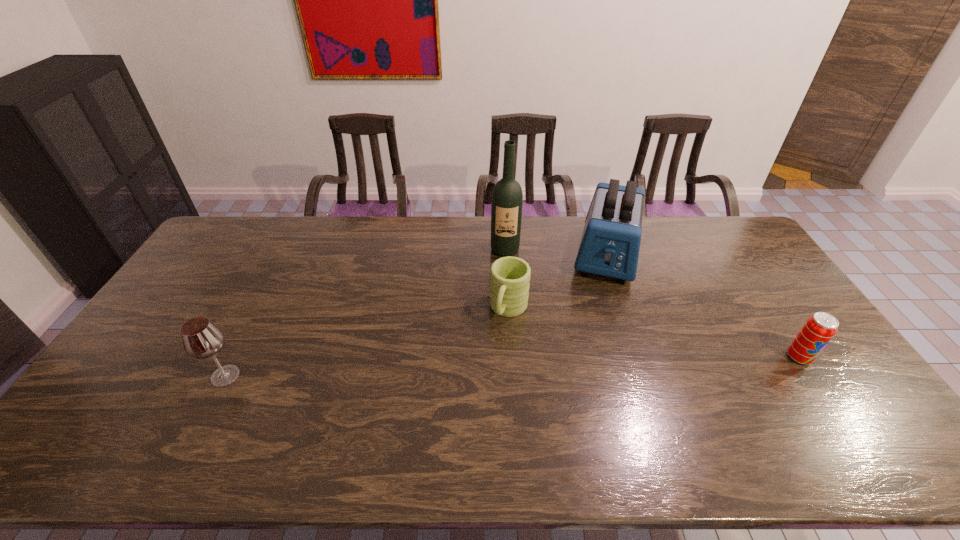
Locate an element on the screen. the leftmost object is located at coordinates (202, 339).

At what (x,y) coordinates should I click in order to perform the action: click on the third shortest object. Please return your answer as a coordinate pair (x, y). Image resolution: width=960 pixels, height=540 pixels. Looking at the image, I should click on (202, 339).

Where is `soda can`? soda can is located at coordinates (819, 329).

Locate an element on the screen. the tallest object is located at coordinates (507, 198).

The height and width of the screenshot is (540, 960). Identify the location of mug. (509, 284).

At what (x,y) coordinates should I click in order to perform the action: click on the second object from right to left. Please return your answer as a coordinate pair (x, y). Looking at the image, I should click on (610, 243).

Where is `toaster`? This screenshot has width=960, height=540. toaster is located at coordinates (610, 243).

This screenshot has height=540, width=960. Identify the location of vacant point located 0.060m on the front of the third shortest object. (207, 410).

Image resolution: width=960 pixels, height=540 pixels. Identify the location of vacant position located 0.320m on the left of the soda can. (673, 357).

Find the location of `vacant space situated 0.280m on the labeled side of the tallest object`. vacant space situated 0.280m on the labeled side of the tallest object is located at coordinates (506, 317).